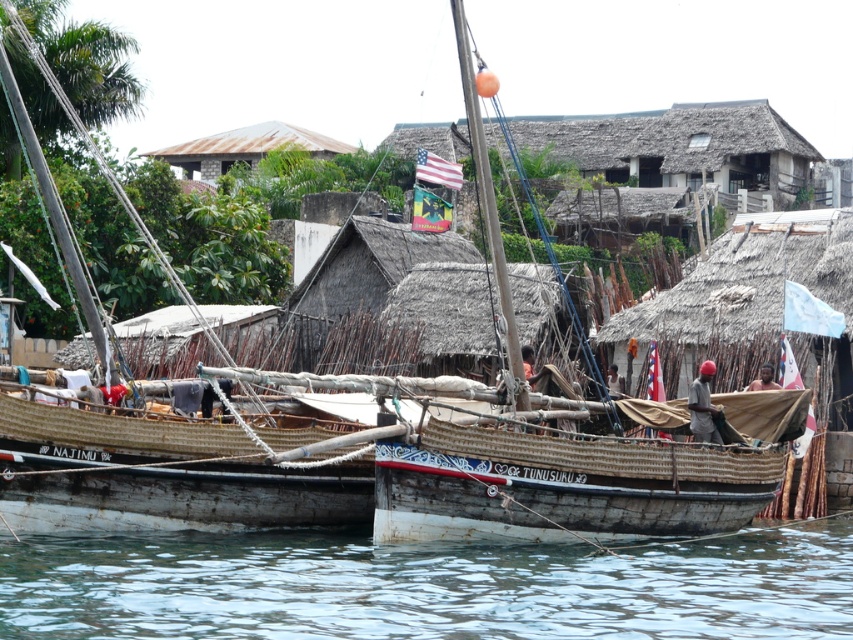
You are standing at the point with coordinates point (x=207, y=157) and want to walk towards the point with coordinates point (x=338, y=636). Which direction should you face to move towards it?

You should face towards the direction of point (x=338, y=636), which is in front of point (x=207, y=157), so you need to face forward to move towards it.

You are standing on the dock and want to step onto the rusty wood boat at center. Which direction should you move relative to the clear water at lower center to reach the boat?

You should move to the left of the clear water at lower center to reach the rusty wood boat at center since the boat is to the left of the water.

You are standing at the waterfront and see the clear water at lower center and the rusty metal roof at upper center. Which object is located to the right side of the other?

The clear water at lower center is to the right of the rusty metal roof at upper center.